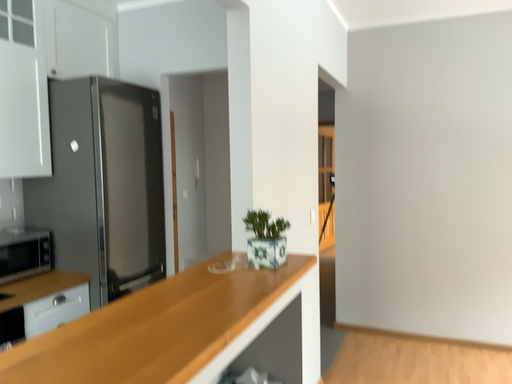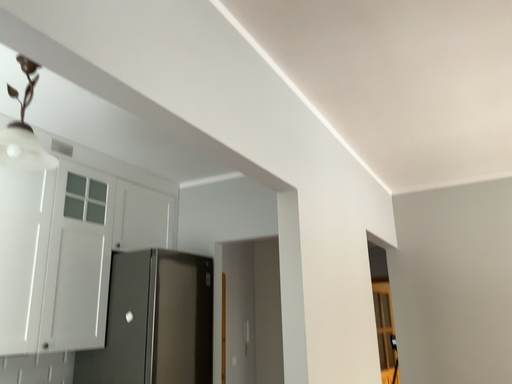
Question: How did the camera likely rotate when shooting the video?

Choices:
 (A) rotated left
 (B) rotated right

Answer: (A)